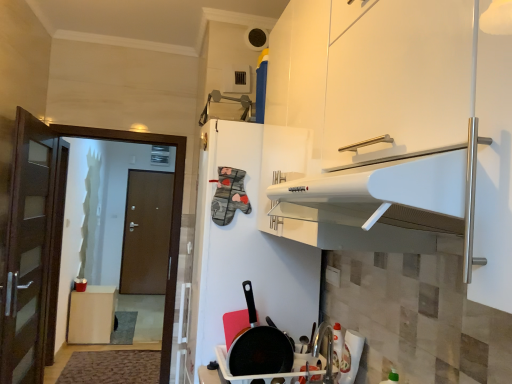
Question: Considering the positions of white matte refrigerator at center and brown matte door at left in the image, is white matte refrigerator at center bigger or smaller than brown matte door at left?

Choices:
 (A) small
 (B) big

Answer: (B)

Question: Considering the positions of white matte refrigerator at center and brown matte door at left in the image, is white matte refrigerator at center wider or thinner than brown matte door at left?

Choices:
 (A) thin
 (B) wide

Answer: (B)

Question: Considering the real-world distances, which object is closest to the white glossy cabinet at upper center?

Choices:
 (A) white matte refrigerator at center
 (B) brown wood trash can at left
 (C) non-stick black frying pan at lower center
 (D) brown wooden door at left
 (E) white glossy sink at lower center

Answer: (A)

Question: Which of these objects is positioned closest to the brown wooden door at left?

Choices:
 (A) brown wood trash can at left
 (B) white glossy cabinet at upper center
 (C) non-stick black frying pan at lower center
 (D) white matte refrigerator at center
 (E) white glossy sink at lower center

Answer: (D)